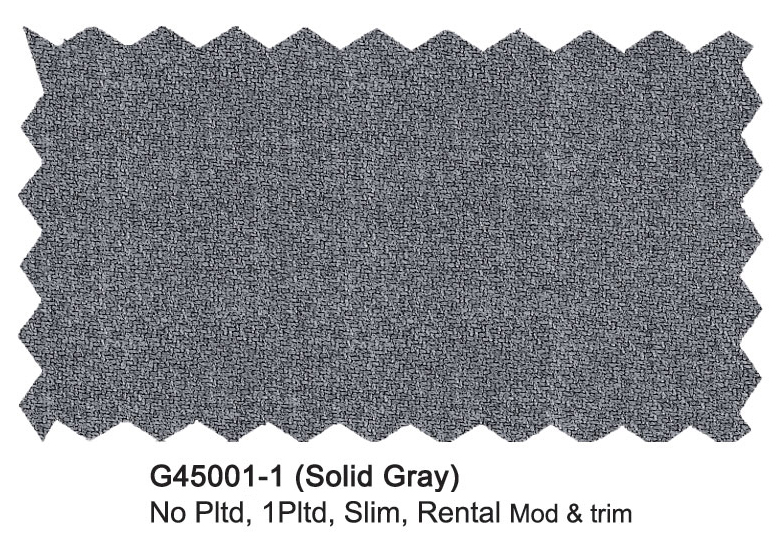
What are the coordinates of `fabric swatch` in the screenshot? It's located at (404, 234).